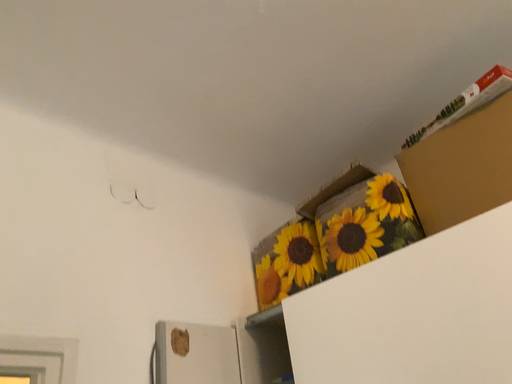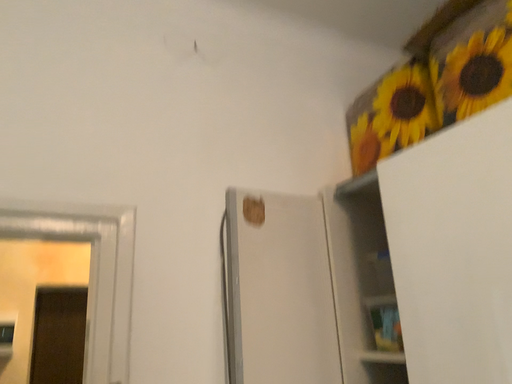
Question: Which way did the camera rotate in the video?

Choices:
 (A) rotated right
 (B) rotated left

Answer: (B)